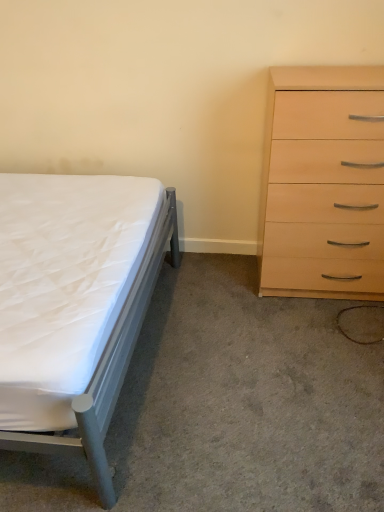
Question: From the image's perspective, relative to light wood/finish chest of drawers at right, is white fabric bed at left above or below?

Choices:
 (A) below
 (B) above

Answer: (A)

Question: Visually, is white fabric bed at left positioned to the left or to the right of light wood/finish chest of drawers at right?

Choices:
 (A) left
 (B) right

Answer: (A)

Question: Which object is the closest to the white matte bed at left?

Choices:
 (A) white fabric bed at left
 (B) light wood/finish chest of drawers at right

Answer: (A)

Question: Which object is positioned closest to the white fabric bed at left?

Choices:
 (A) white matte bed at left
 (B) light wood/finish chest of drawers at right

Answer: (A)